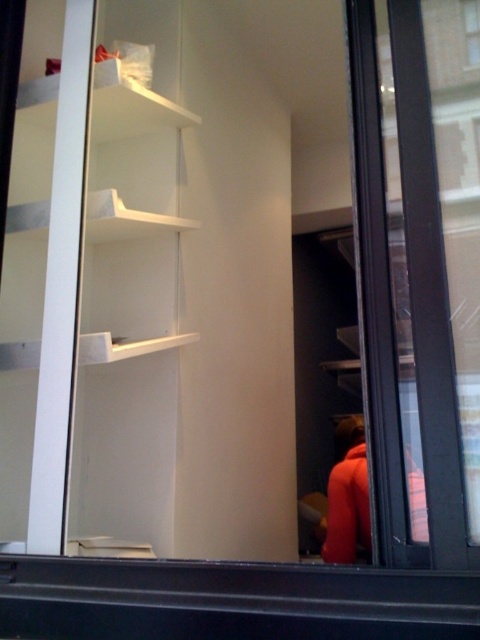
Question: Which of the following is the closest to the observer?

Choices:
 (A) clear glass window at upper right
 (B) orange fabric jacket at right
 (C) transparent glass door at right

Answer: (C)

Question: Does orange fabric jacket at right have a lesser width compared to clear glass window at upper right?

Choices:
 (A) yes
 (B) no

Answer: (B)

Question: Which point is closer to the camera?

Choices:
 (A) (399, 449)
 (B) (336, 429)
 (C) (476, 44)

Answer: (A)

Question: Does transparent glass door at right come behind clear glass window at upper right?

Choices:
 (A) no
 (B) yes

Answer: (A)

Question: Which object is the farthest from the clear glass window at upper right?

Choices:
 (A) transparent glass door at right
 (B) orange fabric jacket at right

Answer: (B)

Question: Is transparent glass door at right further to the viewer compared to orange fabric jacket at right?

Choices:
 (A) no
 (B) yes

Answer: (A)